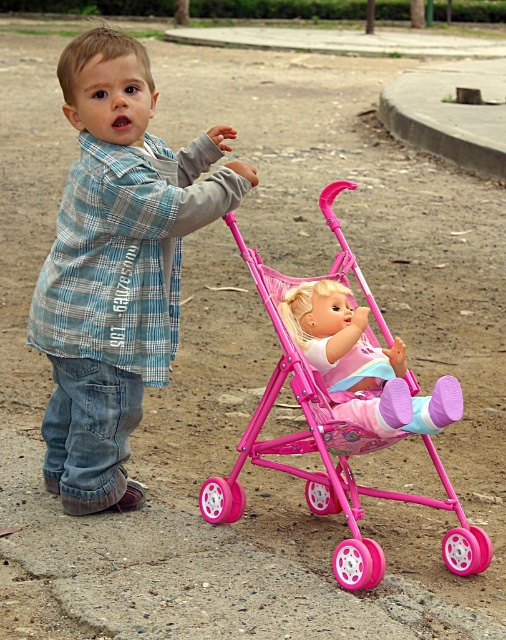
Is the position of blue plaid shirt at center less distant than that of pink plastic doll at center?

No, blue plaid shirt at center is further to the viewer.

Who is taller, blue plaid shirt at center or pink plastic doll at center?

Standing taller between the two is blue plaid shirt at center.

Where is `blue plaid shirt at center`? blue plaid shirt at center is located at coordinates (116, 266).

Where is `blue plaid shirt at center`? blue plaid shirt at center is located at coordinates (116, 266).

From the picture: Who is positioned more to the right, blue plaid shirt at center or pink plastic baby carriage at center?

pink plastic baby carriage at center is more to the right.

Between blue plaid shirt at center and pink plastic baby carriage at center, which one has more height?

With more height is blue plaid shirt at center.

Is point (147, 205) farther from camera compared to point (259, 278)?

No.

You are a GUI agent. You are given a task and a screenshot of the screen. Output one action in this format:
    pyautogui.click(x=<x>, y=<y>)
    Task: Click on the blue plaid shirt at center
    
    Given the screenshot: What is the action you would take?
    pyautogui.click(x=116, y=266)

Is pink plastic baby carriage at center wider than pink plastic doll at center?

Correct, the width of pink plastic baby carriage at center exceeds that of pink plastic doll at center.

Based on the photo, who is more distant from viewer, (358, 566) or (450, 390)?

Point (450, 390)

The width and height of the screenshot is (506, 640). What do you see at coordinates (329, 436) in the screenshot?
I see `pink plastic baby carriage at center` at bounding box center [329, 436].

Identify the location of pink plastic baby carriage at center. This screenshot has width=506, height=640. (329, 436).